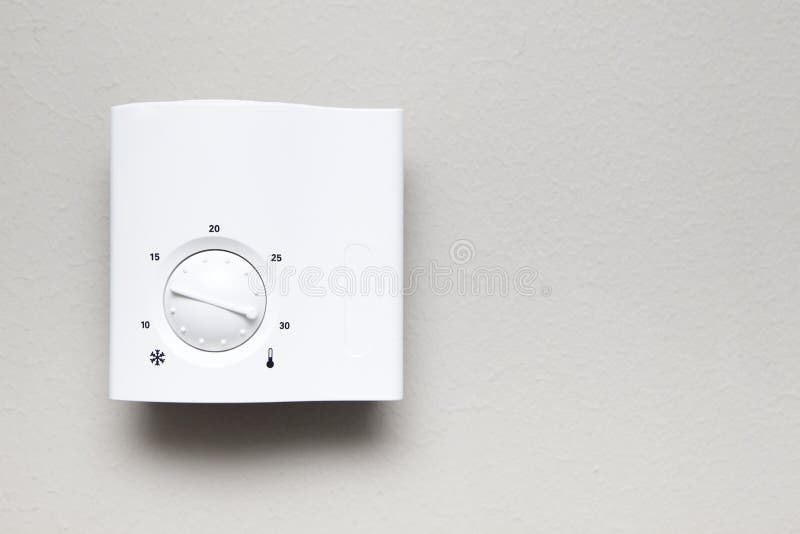
Locate an element on the screen. The width and height of the screenshot is (800, 534). thermostat is located at coordinates (272, 193).